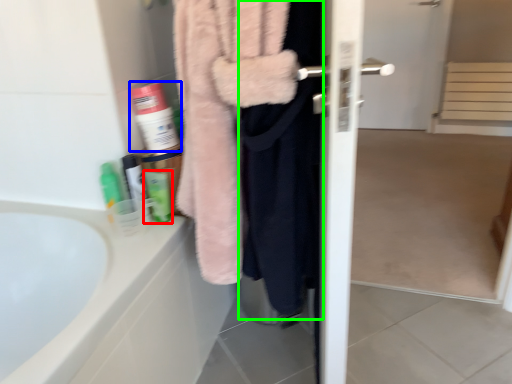
Question: Which object is the closest to the toiletry (highlighted by a red box)? Choose among these: cleaning product (highlighted by a blue box) or clothing (highlighted by a green box).

Choices:
 (A) cleaning product
 (B) clothing

Answer: (A)